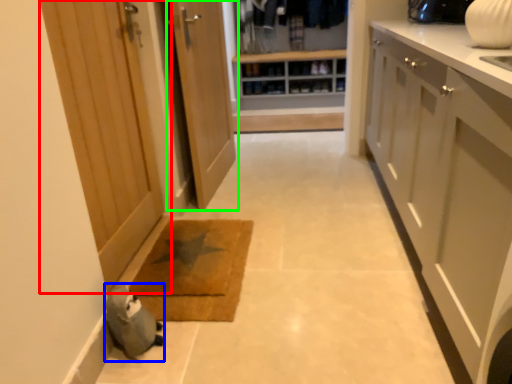
Question: Which is farther away from door (highlighted by a red box)? animal (highlighted by a blue box) or door (highlighted by a green box)?

Choices:
 (A) animal
 (B) door

Answer: (A)